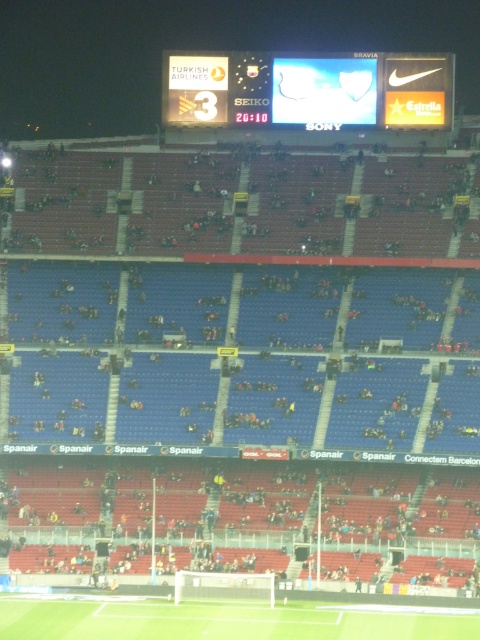
Question: Does white glossy scoreboard at upper center appear on the left side of green grass football field at lower center?

Choices:
 (A) yes
 (B) no

Answer: (B)

Question: Does white glossy scoreboard at upper center have a smaller size compared to green grass football field at lower center?

Choices:
 (A) yes
 (B) no

Answer: (B)

Question: Which object is closer to the camera taking this photo?

Choices:
 (A) green grass football field at lower center
 (B) white glossy scoreboard at upper center

Answer: (A)

Question: Does white glossy scoreboard at upper center appear on the left side of green grass football field at lower center?

Choices:
 (A) no
 (B) yes

Answer: (A)

Question: Among these points, which one is farthest from the camera?

Choices:
 (A) (444, 628)
 (B) (248, 106)

Answer: (B)